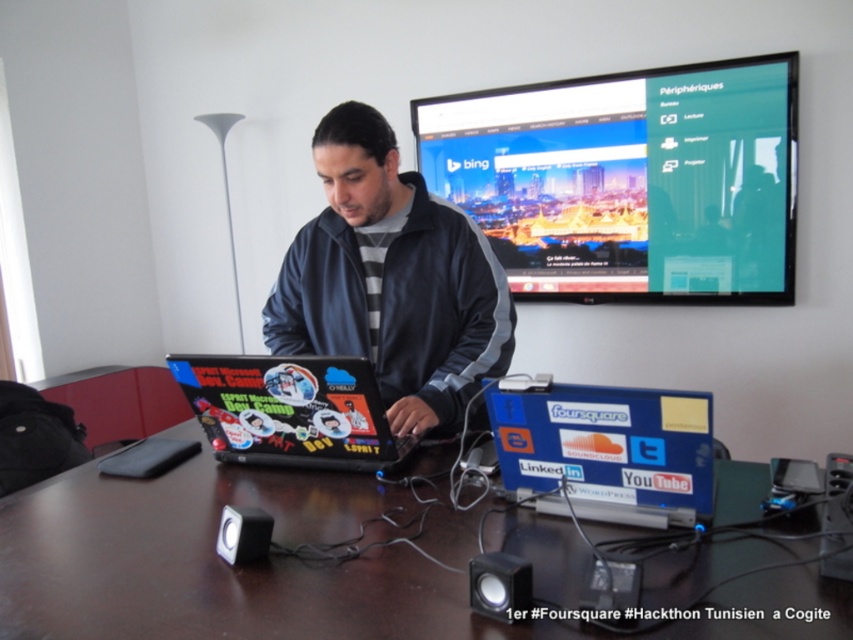
Consider the image. You are organizing a tech conference and need to place a large projector on the brown wooden table at center and the matte black laptop at center. Which object should you place it on first if you want the projector to be closer to the left side of the desk?

You should place the projector on the matte black laptop at center first because the brown wooden table at center is to the right of the matte black laptop at center, so placing the projector on the laptop would position it closer to the left side of the desk.